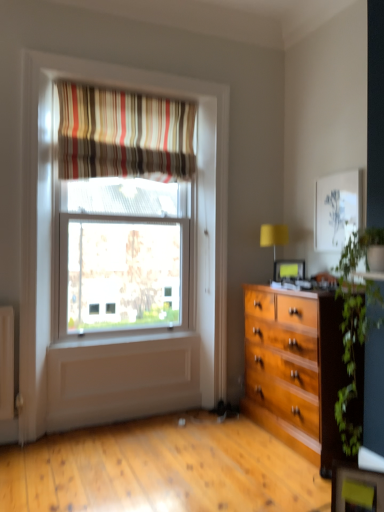
Question: Is matte black picture frame at center in contact with yellow fabric lampshade at right?

Choices:
 (A) no
 (B) yes

Answer: (A)

Question: Can you confirm if matte black picture frame at center is smaller than yellow fabric lampshade at right?

Choices:
 (A) no
 (B) yes

Answer: (B)

Question: Is matte black picture frame at center behind yellow fabric lampshade at right?

Choices:
 (A) yes
 (B) no

Answer: (B)

Question: From a real-world perspective, is matte black picture frame at center located higher than yellow fabric lampshade at right?

Choices:
 (A) yes
 (B) no

Answer: (B)

Question: Is matte black picture frame at center oriented away from yellow fabric lampshade at right?

Choices:
 (A) no
 (B) yes

Answer: (B)

Question: Considering the relative positions of matte black picture frame at center and yellow fabric lampshade at right in the image provided, is matte black picture frame at center in front of yellow fabric lampshade at right?

Choices:
 (A) yes
 (B) no

Answer: (A)

Question: Considering the relative sizes of green leafy plant at right and matte black picture frame at center in the image provided, is green leafy plant at right wider than matte black picture frame at center?

Choices:
 (A) no
 (B) yes

Answer: (B)

Question: Is green leafy plant at right oriented towards matte black picture frame at center?

Choices:
 (A) yes
 (B) no

Answer: (B)

Question: From a real-world perspective, is green leafy plant at right physically below matte black picture frame at center?

Choices:
 (A) no
 (B) yes

Answer: (B)

Question: Is green leafy plant at right at the left side of matte black picture frame at center?

Choices:
 (A) yes
 (B) no

Answer: (B)

Question: From the image's perspective, would you say green leafy plant at right is shown under matte black picture frame at center?

Choices:
 (A) yes
 (B) no

Answer: (A)

Question: Is green leafy plant at right outside matte black picture frame at center?

Choices:
 (A) no
 (B) yes

Answer: (B)

Question: Is yellow fabric lampshade at right wider than striped fabric curtain at upper center?

Choices:
 (A) yes
 (B) no

Answer: (A)